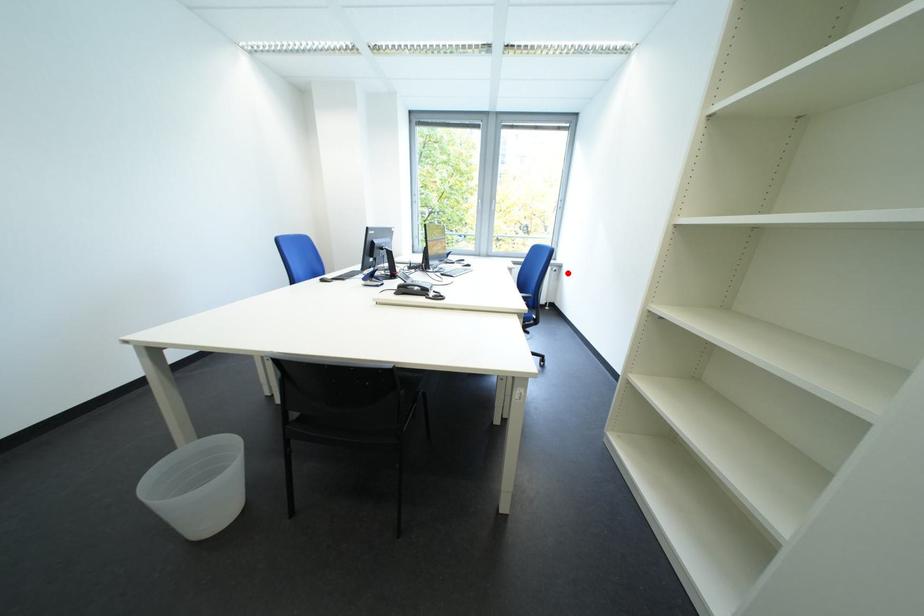
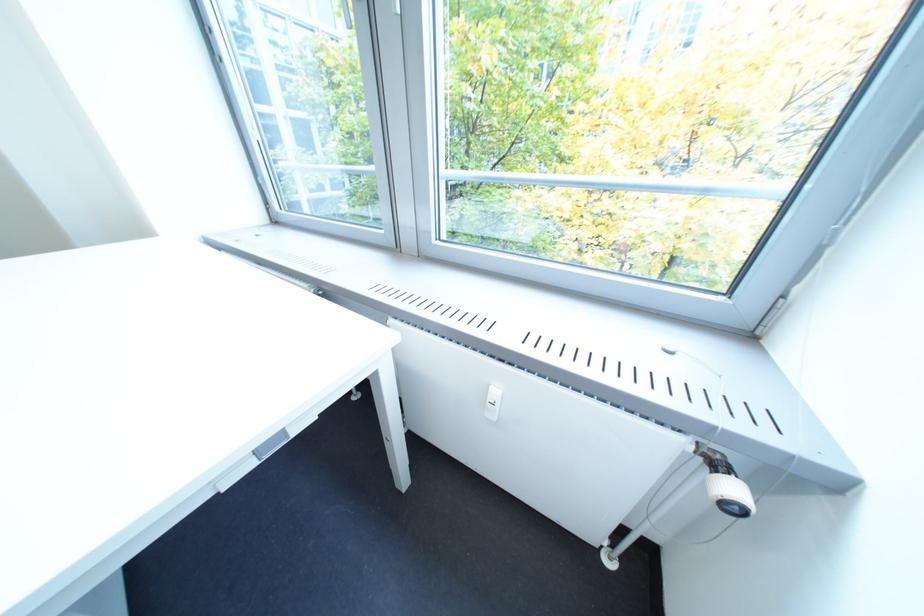
In the second image, find the point that corresponds to the highlighted location in the first image.

(746, 512)